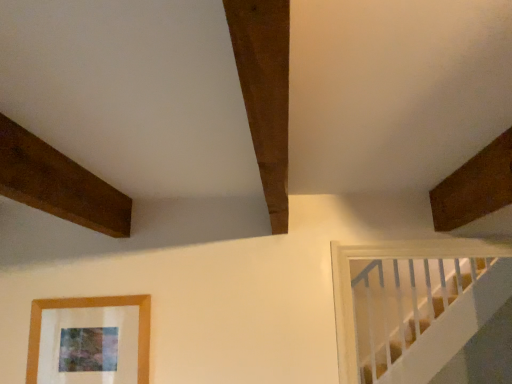
Describe the element at coordinates (87, 307) in the screenshot. The width and height of the screenshot is (512, 384). I see `wooden picture frame at lower left` at that location.

Identify the location of wooden picture frame at lower left. (87, 307).

Where is `wooden picture frame at lower left`? Image resolution: width=512 pixels, height=384 pixels. wooden picture frame at lower left is located at coordinates (87, 307).